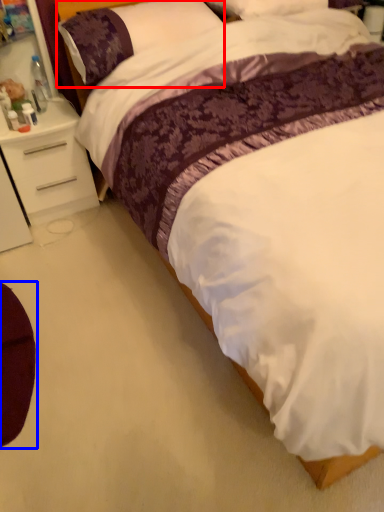
Question: Among these objects, which one is farthest to the camera, pillow (highlighted by a red box) or swivel chair (highlighted by a blue box)?

Choices:
 (A) pillow
 (B) swivel chair

Answer: (A)